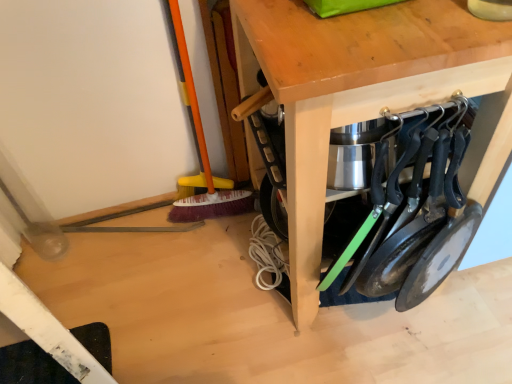
Question: In terms of width, does wooden table at center look wider or thinner when compared to black matte frying pans at lower right?

Choices:
 (A) wide
 (B) thin

Answer: (A)

Question: From a real-world perspective, is wooden table at center positioned above or below black matte frying pans at lower right?

Choices:
 (A) below
 (B) above

Answer: (A)

Question: Visually, is wooden table at center positioned to the left or to the right of black matte frying pans at lower right?

Choices:
 (A) left
 (B) right

Answer: (A)

Question: Considering their positions, is black matte frying pans at lower right located in front of or behind wooden table at center?

Choices:
 (A) front
 (B) behind

Answer: (B)

Question: From the image's perspective, is black matte frying pans at lower right above or below wooden table at center?

Choices:
 (A) below
 (B) above

Answer: (A)

Question: Is point (382, 269) closer or farther from the camera than point (347, 77)?

Choices:
 (A) farther
 (B) closer

Answer: (A)

Question: Looking at the image, does black matte frying pans at lower right seem bigger or smaller compared to wooden table at center?

Choices:
 (A) big
 (B) small

Answer: (B)